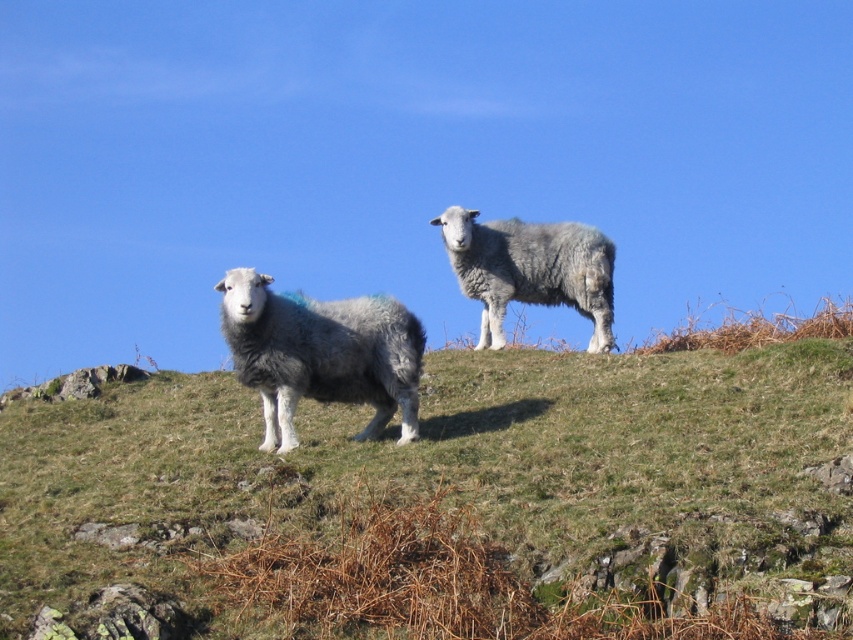
Question: Where is green grassy at center located in relation to fuzzy gray sheep at center in the image?

Choices:
 (A) below
 (B) above

Answer: (A)

Question: Where is green grassy at center located in relation to fuzzy gray sheep at center in the image?

Choices:
 (A) right
 (B) left

Answer: (A)

Question: Estimate the real-world distances between objects in this image. Which object is farther from the fuzzy gray sheep at center?

Choices:
 (A) green grassy at center
 (B) gray woolly sheep at center

Answer: (B)

Question: Where is green grassy at center located in relation to gray woolly sheep at center in the image?

Choices:
 (A) right
 (B) left

Answer: (B)

Question: Which of the following is the farthest from the observer?

Choices:
 (A) gray woolly sheep at center
 (B) green grassy at center
 (C) fuzzy gray sheep at center

Answer: (A)

Question: Which of the following is the farthest from the observer?

Choices:
 (A) (645, 369)
 (B) (544, 228)

Answer: (B)